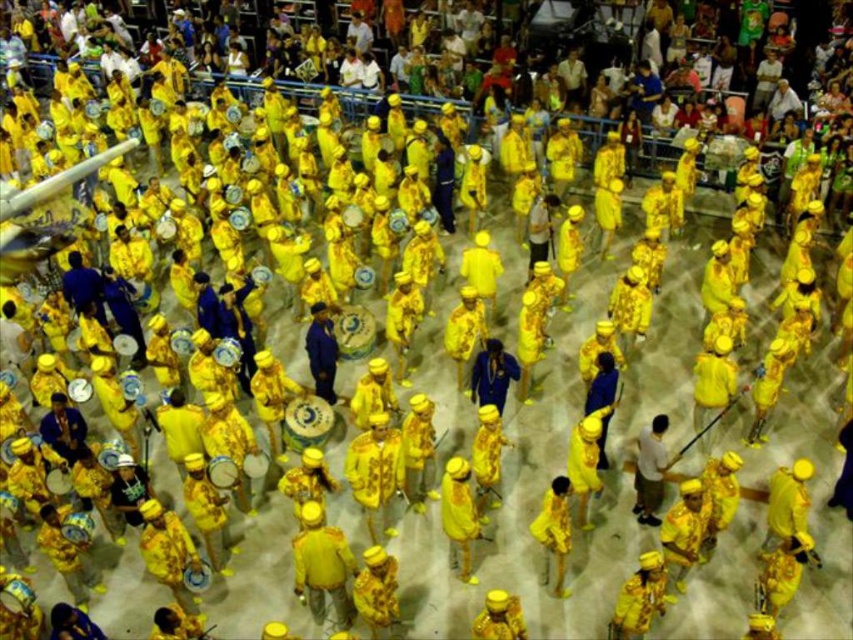
Question: Does yellow fabric drum at center have a greater width compared to yellow matte uniform at center?

Choices:
 (A) yes
 (B) no

Answer: (A)

Question: Which is farther from the yellow fabric hat at center?

Choices:
 (A) yellow matte uniform at center
 (B) white matte shirt at center

Answer: (B)

Question: Which point is closer to the camera?

Choices:
 (A) blue velvet suit at center
 (B) matte blue suit at center

Answer: (B)

Question: Does yellow fabric drum at center appear under yellow matte hat at center?

Choices:
 (A) yes
 (B) no

Answer: (B)

Question: Which object is positioned closest to the white matte shirt at center?

Choices:
 (A) yellow fabric hat at center
 (B) blue velvet suit at center
 (C) matte blue suit at center
 (D) yellow matte uniform at center

Answer: (D)

Question: Is yellow fabric drum at center to the right of yellow matte uniform at center from the viewer's perspective?

Choices:
 (A) no
 (B) yes

Answer: (A)